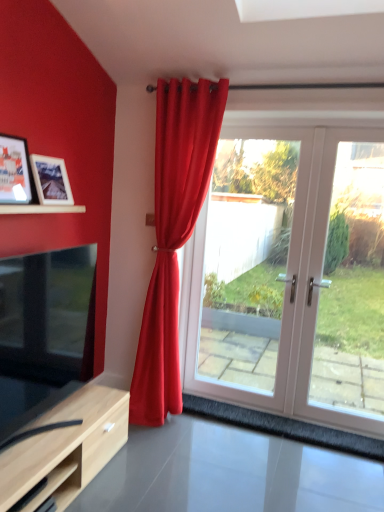
Question: Is white glossy glass door at right looking in the opposite direction of matte black tv at lower left?

Choices:
 (A) no
 (B) yes

Answer: (A)

Question: Does white glossy glass door at right have a larger size compared to matte black tv at lower left?

Choices:
 (A) yes
 (B) no

Answer: (B)

Question: Considering the relative sizes of white glossy glass door at right and matte black tv at lower left in the image provided, is white glossy glass door at right smaller than matte black tv at lower left?

Choices:
 (A) yes
 (B) no

Answer: (A)

Question: Considering the relative sizes of white glossy glass door at right and matte black tv at lower left in the image provided, is white glossy glass door at right shorter than matte black tv at lower left?

Choices:
 (A) no
 (B) yes

Answer: (A)

Question: From a real-world perspective, is white glossy glass door at right below matte black tv at lower left?

Choices:
 (A) yes
 (B) no

Answer: (B)

Question: Can you confirm if white glossy glass door at right is wider than matte black tv at lower left?

Choices:
 (A) yes
 (B) no

Answer: (B)

Question: Does white glossy door at center have a greater height compared to matte wooden picture frame at upper left, the 1th picture frame when ordered from back to front?

Choices:
 (A) no
 (B) yes

Answer: (B)

Question: Can matte wooden picture frame at upper left, the 2th picture frame in the front-to-back sequence, be found inside white glossy door at center?

Choices:
 (A) no
 (B) yes

Answer: (A)

Question: Is white glossy door at center to the left of matte wooden picture frame at upper left, the 2th picture frame in the front-to-back sequence, from the viewer's perspective?

Choices:
 (A) yes
 (B) no

Answer: (B)

Question: From the image's perspective, would you say white glossy door at center is shown under matte wooden picture frame at upper left, the 1th picture frame when ordered from back to front?

Choices:
 (A) yes
 (B) no

Answer: (A)

Question: Is the surface of white glossy door at center in direct contact with matte wooden picture frame at upper left, the 2th picture frame in the front-to-back sequence?

Choices:
 (A) no
 (B) yes

Answer: (A)

Question: Is there a large distance between white glossy door at center and matte wooden picture frame at upper left, the 1th picture frame when ordered from back to front?

Choices:
 (A) yes
 (B) no

Answer: (A)

Question: Is matte wooden picture frame at upper left, the 2th picture frame in the front-to-back sequence, smaller than wooden picture frame at left, which ranks as the first picture frame in front-to-back order?

Choices:
 (A) no
 (B) yes

Answer: (A)